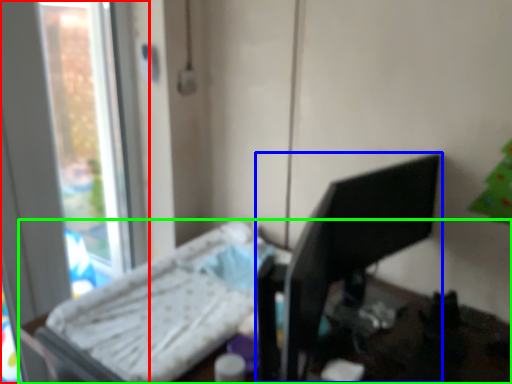
Question: Which is nearer to the window (highlighted by a red box)? desktop computer (highlighted by a blue box) or furniture (highlighted by a green box).

Choices:
 (A) desktop computer
 (B) furniture

Answer: (B)